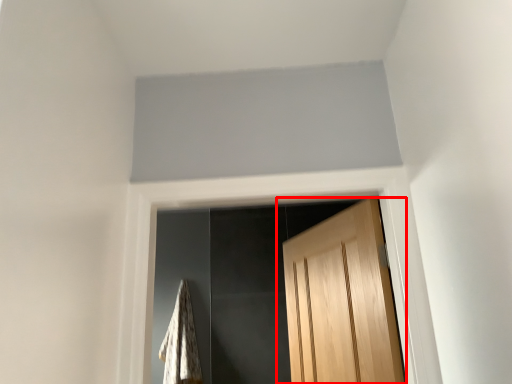
Question: Considering the relative positions of door (annotated by the red box) and blanket in the image provided, where is door (annotated by the red box) located with respect to the staircase?

Choices:
 (A) right
 (B) left

Answer: (A)